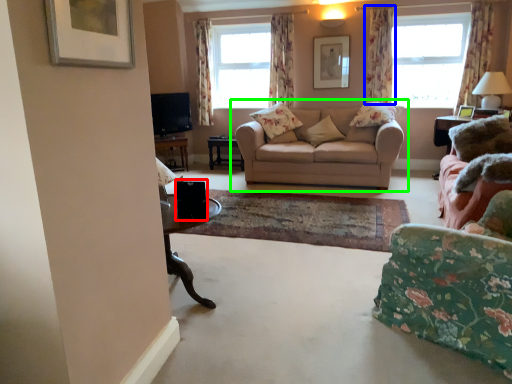
Question: Based on their relative distances, which object is farther from speaker (highlighted by a red box)? Choose from curtain (highlighted by a blue box) and studio couch (highlighted by a green box).

Choices:
 (A) curtain
 (B) studio couch

Answer: (A)